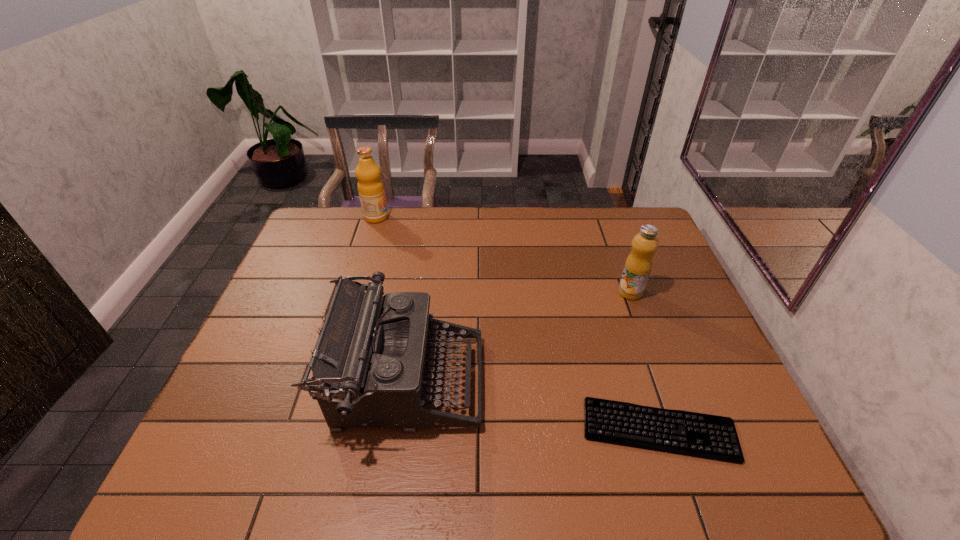
I want to click on the left fruit juice, so click(x=371, y=191).

The image size is (960, 540). I want to click on the farthest object, so click(371, 191).

Find the location of a particular element. the nearer fruit juice is located at coordinates (638, 265).

Identify the location of the right fruit juice. This screenshot has height=540, width=960. tap(638, 265).

Image resolution: width=960 pixels, height=540 pixels. What are the coordinates of `typewriter` in the screenshot? It's located at click(x=369, y=364).

I want to click on computer keyboard, so click(712, 437).

You are a GUI agent. You are given a task and a screenshot of the screen. Output one action in this format:
    pyautogui.click(x=<x>, y=<y>)
    Task: Click on the free space located on the front label of the farther fruit juice
    The image size is (960, 540).
    Given the screenshot: What is the action you would take?
    pyautogui.click(x=459, y=217)

Identify the location of free location located on the front label of the second farthest object. (659, 370).

You are a GUI agent. You are given a task and a screenshot of the screen. Output one action in this format:
    pyautogui.click(x=<x>, y=<y>)
    Task: Click on the free point located on the typing side of the typewriter
    The height and width of the screenshot is (540, 960).
    Given the screenshot: What is the action you would take?
    pyautogui.click(x=607, y=382)

Where is `free space located 0.130m on the back of the computer keyboard`? free space located 0.130m on the back of the computer keyboard is located at coordinates (636, 355).